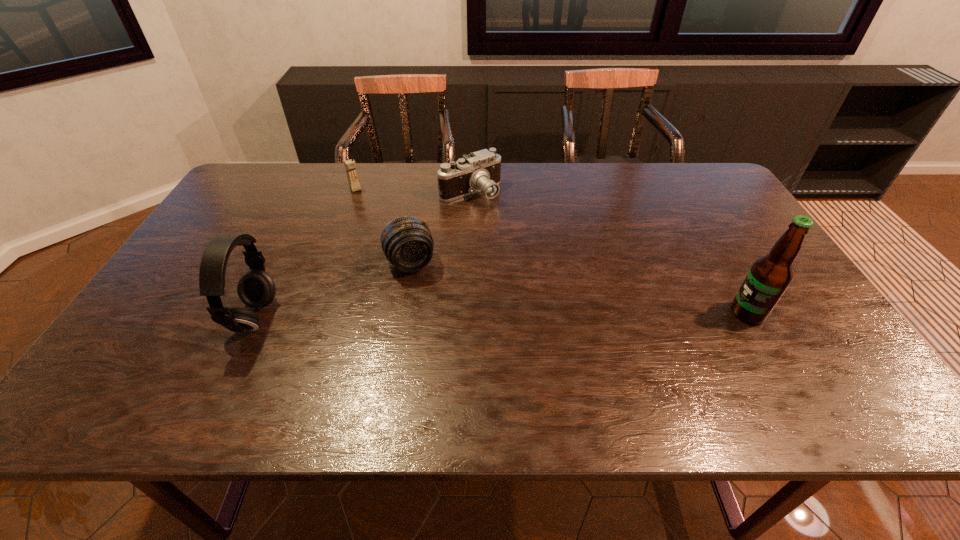
Identify the location of vacant space located on the ear cups of the fourth shortest object. (158, 317).

I want to click on vacant area located on the label of the rightmost object, so click(x=640, y=313).

At what (x,y) coordinates should I click in order to perform the action: click on free location located 0.060m on the label of the rightmost object. Please return your answer as a coordinate pair (x, y). Image resolution: width=960 pixels, height=540 pixels. Looking at the image, I should click on (706, 313).

Identify the location of free region located 0.350m on the label of the rightmost object. (587, 313).

This screenshot has height=540, width=960. I want to click on vacant space located on the front of the third tallest object, where the keypad is located, so click(x=366, y=204).

You are a GUI agent. You are given a task and a screenshot of the screen. Output one action in this format:
    pyautogui.click(x=<x>, y=<y>)
    Task: Click on the vacant region located 0.260m on the front of the third tallest object, where the keypad is located
    
    Given the screenshot: What is the action you would take?
    pyautogui.click(x=387, y=235)

The height and width of the screenshot is (540, 960). I want to click on free space located on the front of the third tallest object, where the keypad is located, so click(406, 263).

I want to click on vacant point located 0.140m at the front element of the telephoto lens, so click(x=431, y=317).

This screenshot has width=960, height=540. Identify the location of vacant space located 0.250m at the front element of the telephoto lens. (444, 352).

I want to click on vacant space located at the front element of the telephoto lens, so click(x=434, y=326).